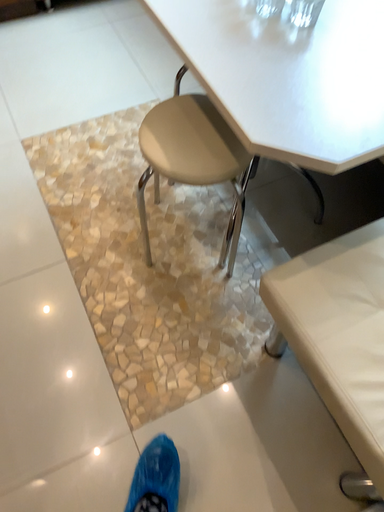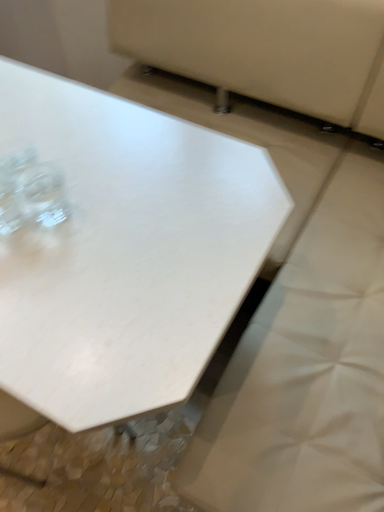
Question: How did the camera likely rotate when shooting the video?

Choices:
 (A) rotated downward
 (B) rotated upward

Answer: (B)